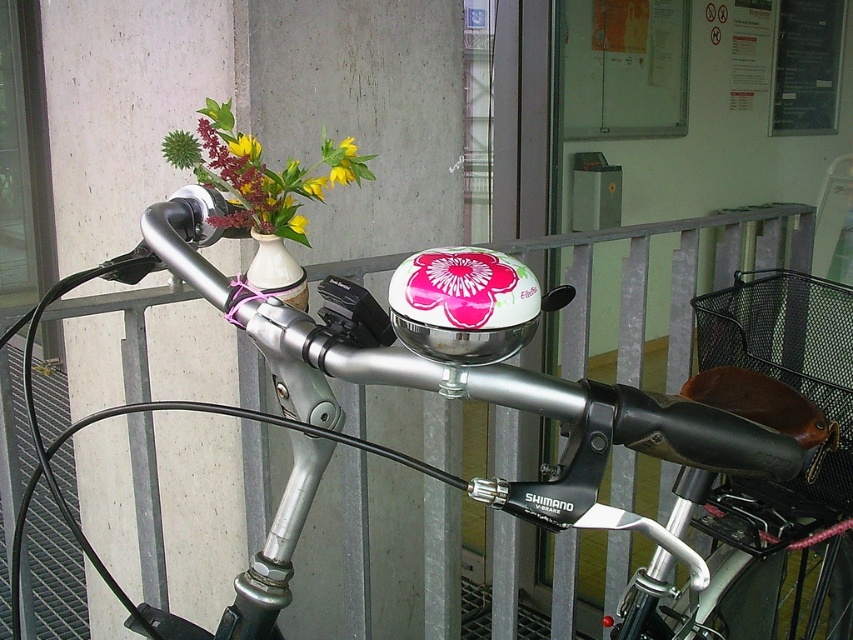
Question: From the image, what is the correct spatial relationship of shiny metallic bicycle handlebar at center in relation to matte ceramic vase at upper left?

Choices:
 (A) below
 (B) above

Answer: (A)

Question: Which point appears closest to the camera in this image?

Choices:
 (A) (840, 324)
 (B) (296, 224)

Answer: (B)

Question: Which point appears farthest from the camera in this image?

Choices:
 (A) (297, 264)
 (B) (746, 324)

Answer: (B)

Question: Which object appears closest to the camera in this image?

Choices:
 (A) yellow fabric flower at upper center
 (B) matte ceramic vase at upper left
 (C) shiny metallic bicycle handlebar at center

Answer: (C)

Question: Where is floral print helmet at center located in relation to yellow fabric flower at upper center in the image?

Choices:
 (A) left
 (B) right

Answer: (B)

Question: Does floral print helmet at center have a lesser width compared to yellow fabric flower at upper center?

Choices:
 (A) no
 (B) yes

Answer: (A)